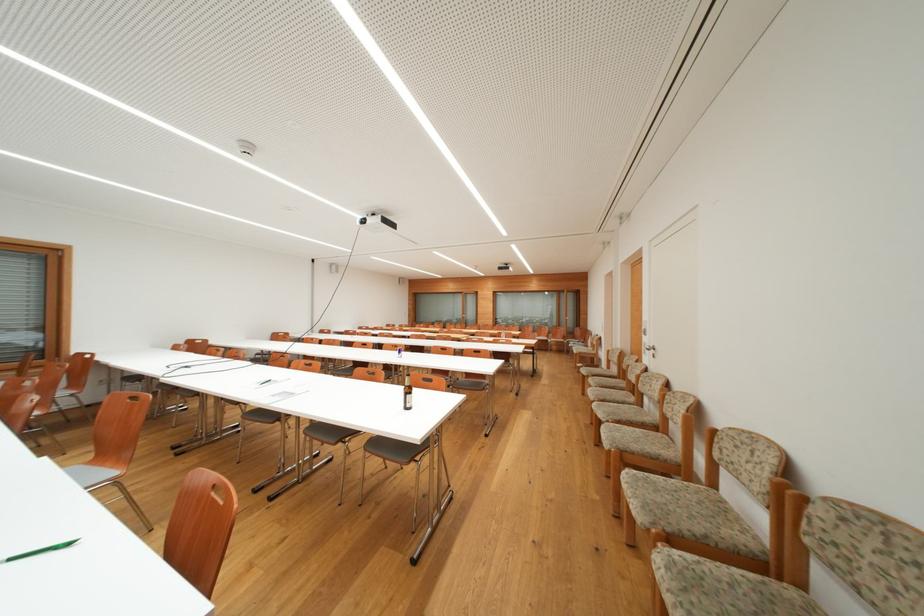
Find where to lift the brown glass bottle. Please return your answer as a coordinate pair (x, y).

(407, 392)